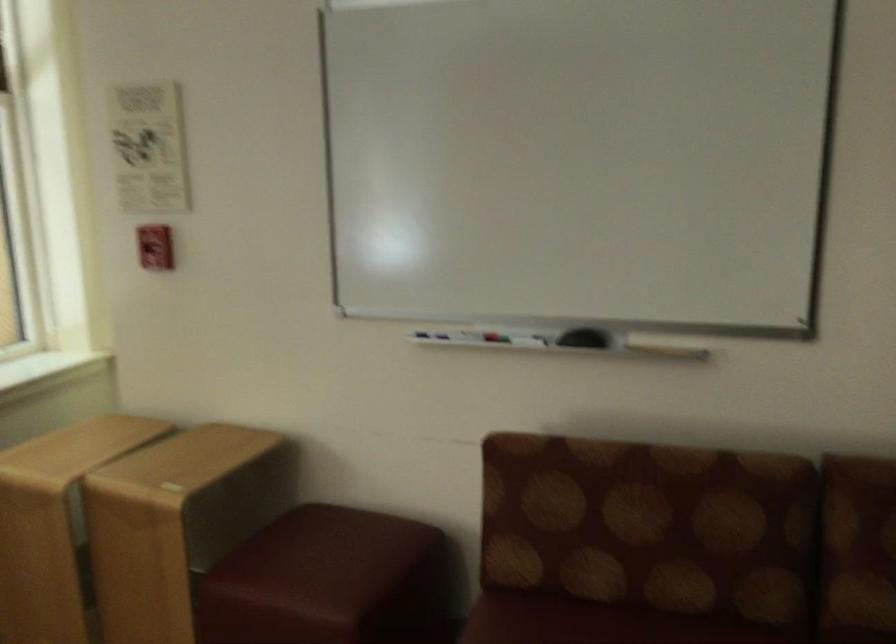
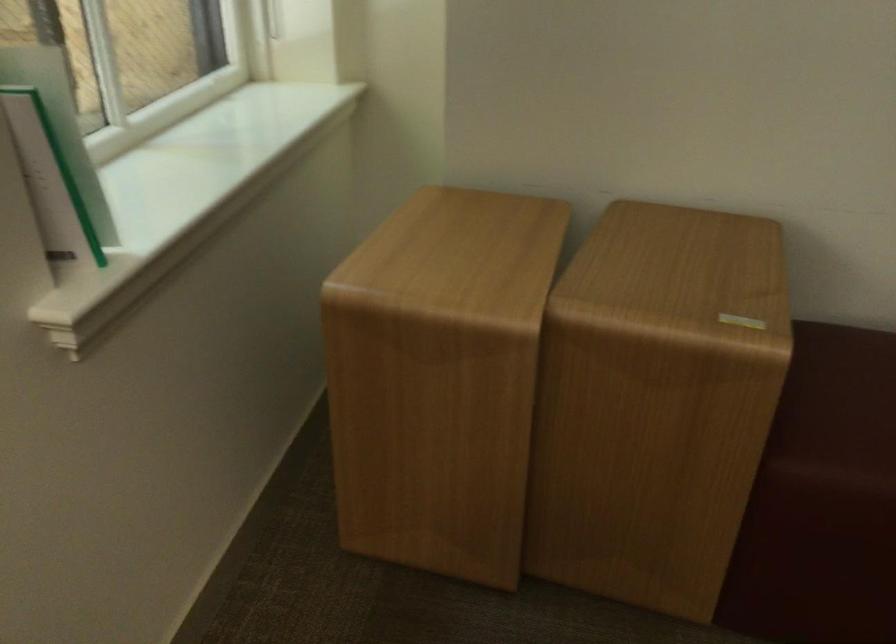
In a continuous first-person perspective shot, in which direction is the camera moving?

The cameraman walked toward left, forward.